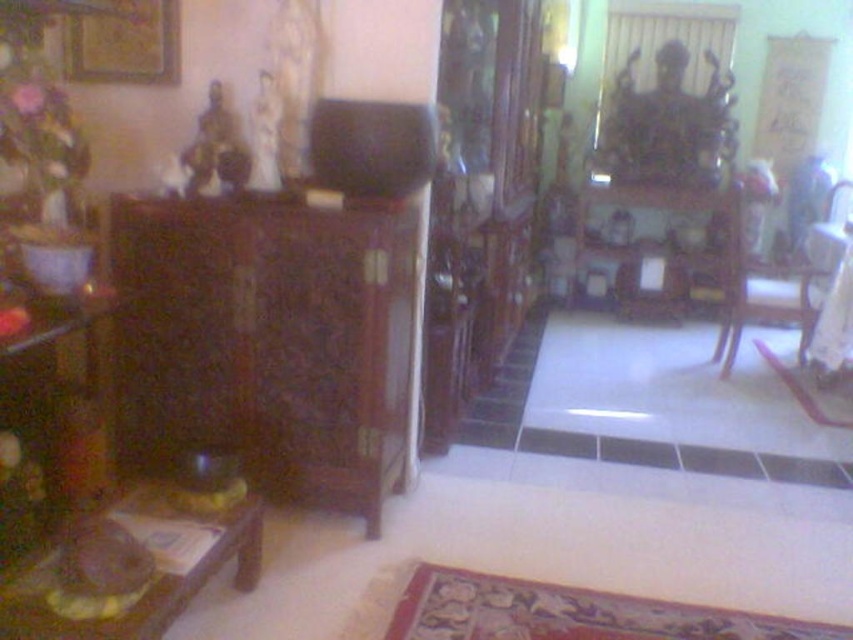
You are organizing a party and need to place a centerpiece on the wooden tray at lower left. Since the wooden picture frame at upper left is currently occupying space there, will the frame fit on the tray?

The wooden tray at lower left is larger in size than the wooden picture frame at upper left, so the frame will fit on the tray.

You are standing in the living room and want to place a small plant on the wooden tray at lower left. Based on the scene description, where exactly should you place the plant in terms of coordinates?

The wooden tray at lower left is located at coordinates (x=157, y=570), so you should place the small plant at those coordinates.

You are standing in the living room and want to place a small plant on the wooden tray at lower left. Based on the scene description, where exactly should you place the plant?

The wooden tray at lower left is located at the 2D coordinates point (157, 570), so you should place the small plant there.